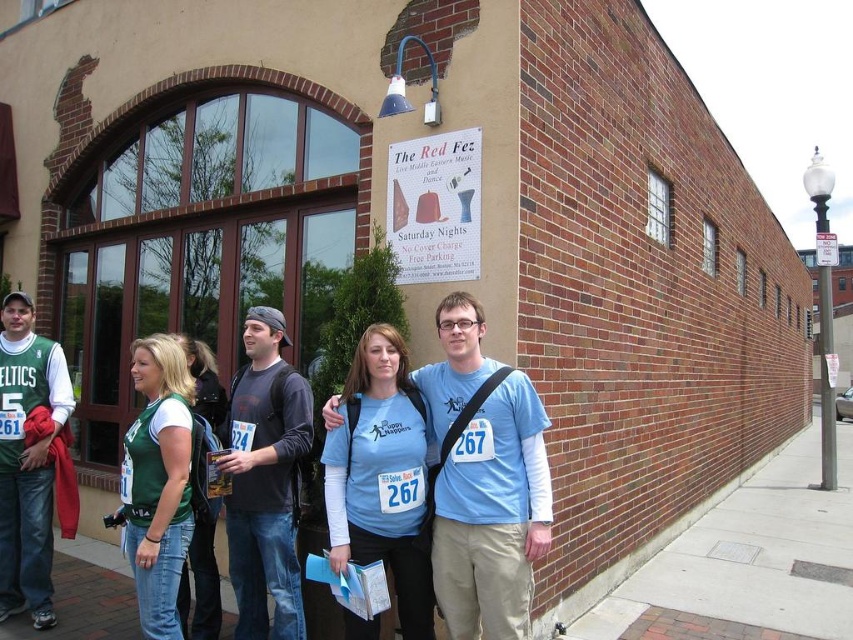
You are organizing a photo shoot and need to arrange two shirts, the blue fabric shirt at center and the green fabric shirt at center, on a mannequin. Based on the scene description, which shirt should be placed on the left side of the mannequin to ensure proper visibility given their sizes?

The blue fabric shirt at center should be placed on the left side of the mannequin because it is wider than the green fabric shirt at center, allowing it to be more visible when positioned on the left.

Based on the photo, you are standing at the point labeled point [404,564]. You want to walk to the building entrance which is 3.90 meters away. If your walking speed is 1.2 meters per second, how many seconds will it take you to reach the entrance?

The distance to the building entrance is 3.90 meters. At a speed of 1.2 meters per second, the time required is 3.90 divided by 1.2, which equals 3.25 seconds.

You are standing at the camera position and want to reach the point marked at coordinates point (776, 513). If your walking speed is 3 feet per second, how many seconds will it take you to reach that point?

The distance between the camera and the point (776, 513) is 30.12 feet. At a speed of 3 feet per second, it will take 30.12 divided by 3, which equals approximately 10.04 seconds to reach the point.